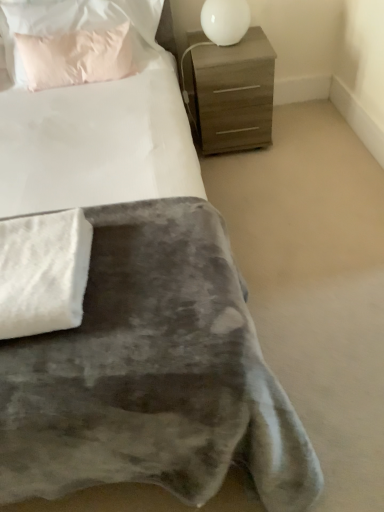
You are a GUI agent. You are given a task and a screenshot of the screen. Output one action in this format:
    pyautogui.click(x=<x>, y=<y>)
    Task: Click on the free space in front of white glossy table lamp at upper right
    Image resolution: width=384 pixels, height=512 pixels.
    Given the screenshot: What is the action you would take?
    pyautogui.click(x=232, y=55)